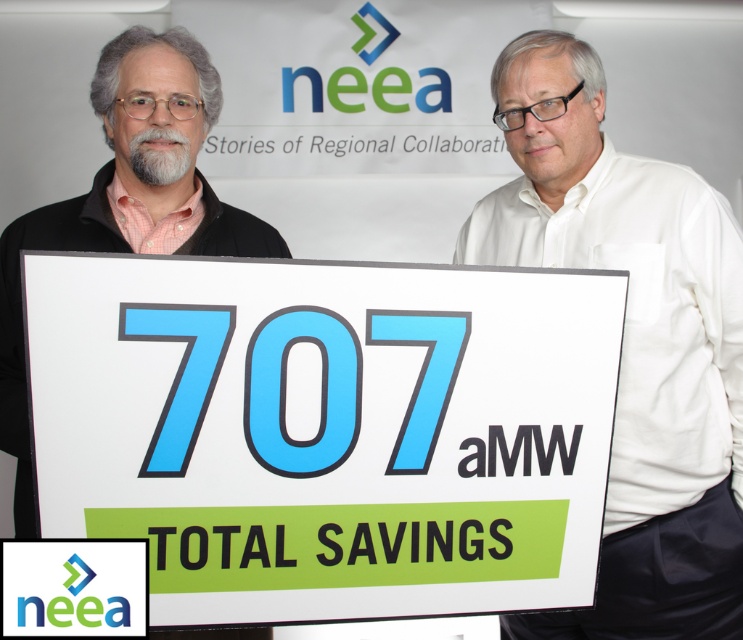
Question: Which object is closer to the camera taking this photo?

Choices:
 (A) white paper sign at center
 (B) matte black shirt at left

Answer: (A)

Question: Can you confirm if white shirt at center is thinner than matte black shirt at left?

Choices:
 (A) no
 (B) yes

Answer: (B)

Question: Does white shirt at center appear over matte black shirt at left?

Choices:
 (A) yes
 (B) no

Answer: (B)

Question: Can you confirm if white paper sign at center is positioned above matte black shirt at left?

Choices:
 (A) yes
 (B) no

Answer: (B)

Question: Which point is farther to the camera?

Choices:
 (A) matte black shirt at left
 (B) white paper sign at center
 (C) white shirt at center

Answer: (C)

Question: Which point appears farthest from the camera in this image?

Choices:
 (A) (694, 540)
 (B) (33, 515)
 (C) (32, 451)

Answer: (B)